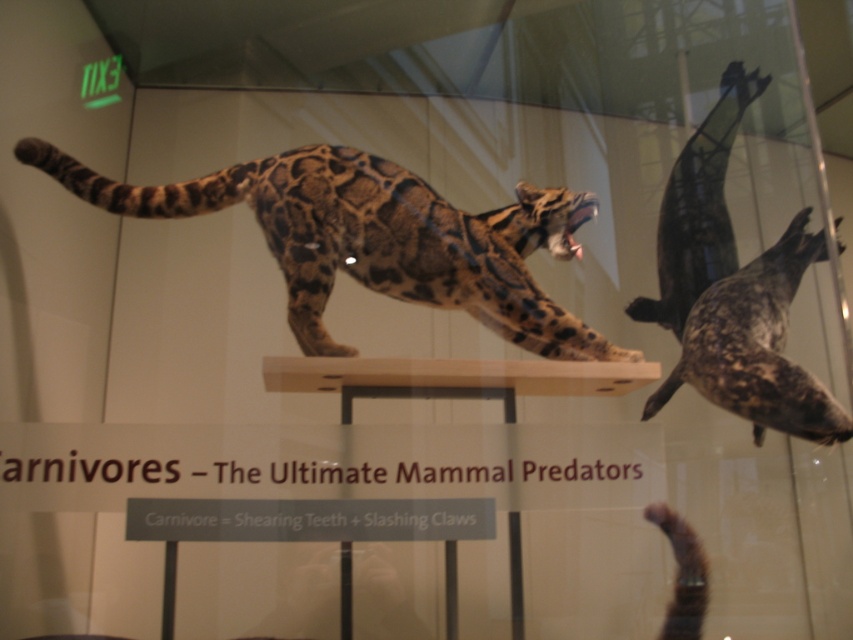
You are a museum visitor standing in front of the exhibit. There are two points marked on the display. Which point is closer to you, point (440,209) or point (740,284)?

Point (440,209) is closer to the viewer than point (740,284).